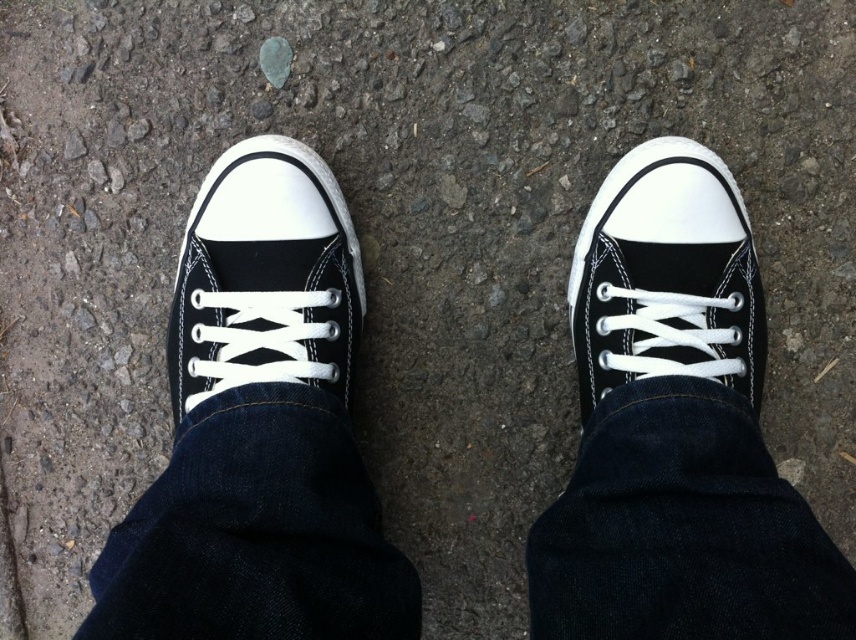
Question: Can you confirm if black canvas shoe at left is thinner than black canvas shoe at right?

Choices:
 (A) no
 (B) yes

Answer: (A)

Question: Can you confirm if black canvas shoe at left is positioned below black canvas shoe at right?

Choices:
 (A) yes
 (B) no

Answer: (B)

Question: Can you confirm if black canvas shoe at left is positioned to the left of black canvas shoe at right?

Choices:
 (A) no
 (B) yes

Answer: (B)

Question: Which of the following is the closest to the observer?

Choices:
 (A) (217, 392)
 (B) (708, 221)

Answer: (A)